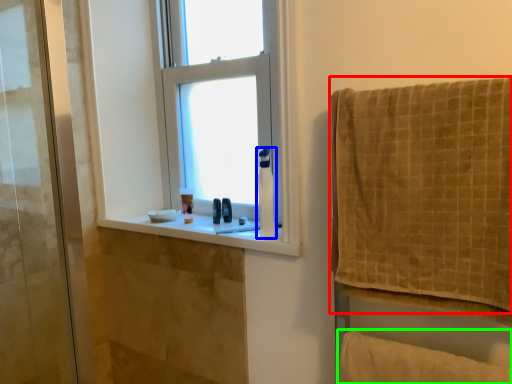
Question: Considering the real-world distances, which object is farthest from towel (highlighted by a red box)? toilet paper (highlighted by a blue box) or bath towel (highlighted by a green box)?

Choices:
 (A) toilet paper
 (B) bath towel

Answer: (A)